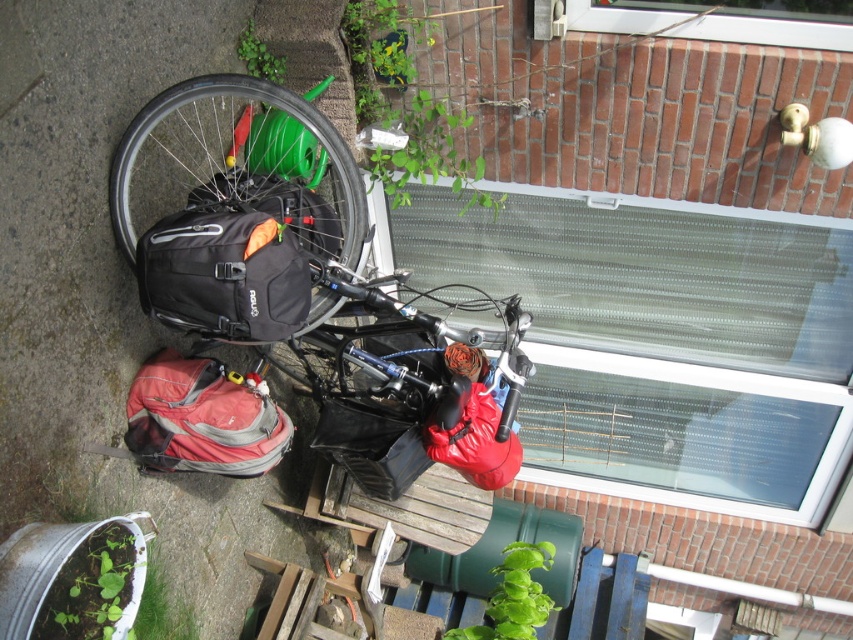
Between point (279, 444) and point (495, 419), which one is positioned behind?

The point (279, 444) is more distant.

Can you confirm if matte pink backpack at lower left is positioned above matte red bag at center?

Correct, matte pink backpack at lower left is located above matte red bag at center.

Where is `matte pink backpack at lower left`? The height and width of the screenshot is (640, 853). matte pink backpack at lower left is located at coordinates (202, 419).

Image resolution: width=853 pixels, height=640 pixels. I want to click on matte pink backpack at lower left, so click(x=202, y=419).

Does matte black bicycle at center have a larger size compared to matte red bag at center?

Indeed, matte black bicycle at center has a larger size compared to matte red bag at center.

Does matte black bicycle at center have a lesser height compared to matte red bag at center?

No, matte black bicycle at center is not shorter than matte red bag at center.

Between point (282, 168) and point (486, 474), which one is positioned in front?

Point (486, 474) is in front.

Find the location of a particular element. The height and width of the screenshot is (640, 853). matte black bicycle at center is located at coordinates (235, 160).

Find the location of a particular element. The height and width of the screenshot is (640, 853). matte black bicycle at center is located at coordinates (235, 160).

Consider the image. Is matte black bicycle at center wider than matte pink backpack at lower left?

Indeed, matte black bicycle at center has a greater width compared to matte pink backpack at lower left.

Based on the photo, who is more distant from viewer, (257, 77) or (288, 433)?

The point (288, 433) is more distant.

The height and width of the screenshot is (640, 853). I want to click on matte black bicycle at center, so click(x=235, y=160).